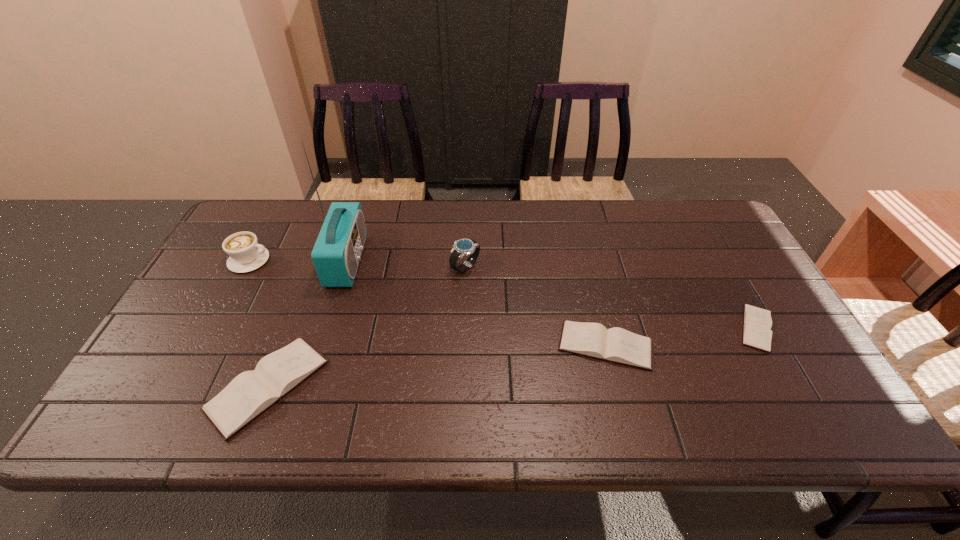
The width and height of the screenshot is (960, 540). In order to click on vacant area situated on the left of the second object from right to left in this screenshot , I will do `click(441, 346)`.

The height and width of the screenshot is (540, 960). Find the location of `vacant space located 0.200m on the back of the shortest diary`. vacant space located 0.200m on the back of the shortest diary is located at coordinates (715, 255).

The image size is (960, 540). In order to click on vacant space located 0.050m to the right of the leftmost object's handle in this screenshot , I will do 287,260.

Identify the location of free space located on the front panel of the tallest object. The height and width of the screenshot is (540, 960). (454, 261).

Identify the location of vacant space positioned 0.080m on the right of the third object from right to left. This screenshot has height=540, width=960. (507, 267).

Identify the location of object that is positioned at the far edge. The image size is (960, 540). (336, 254).

Identify the location of object present at the left edge. (245, 253).

In order to click on object located at the right edge in this screenshot , I will do `click(757, 322)`.

Where is `vacant area at the far edge`? vacant area at the far edge is located at coordinates (431, 227).

The height and width of the screenshot is (540, 960). I want to click on free space at the near edge, so click(x=373, y=391).